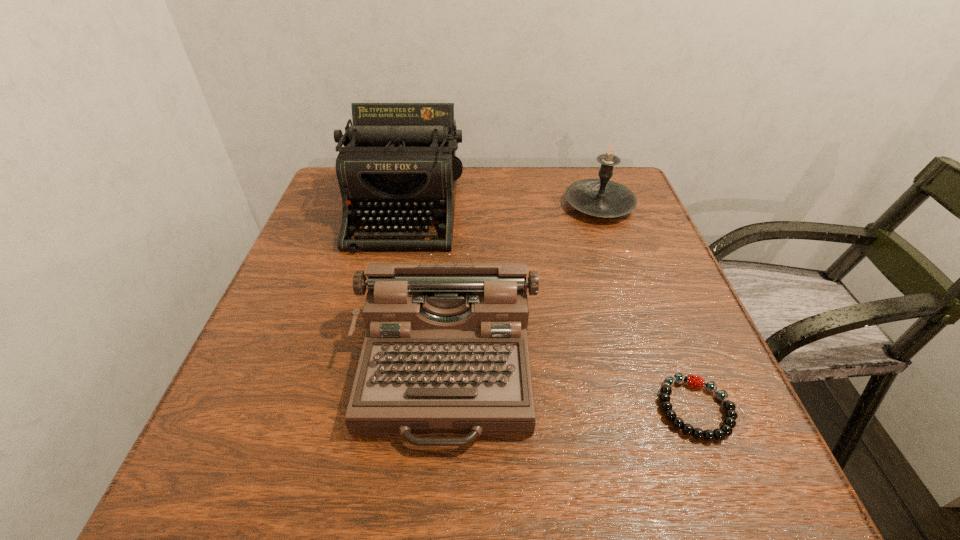
I want to click on object present at the near edge, so click(446, 352).

The height and width of the screenshot is (540, 960). Find the location of `object that is at the left edge`. object that is at the left edge is located at coordinates (398, 163).

The width and height of the screenshot is (960, 540). Identify the location of candle that is at the right edge. (601, 197).

Image resolution: width=960 pixels, height=540 pixels. What are the coordinates of `bracelet present at the right edge` in the screenshot? It's located at (726, 429).

Find the location of a particular element. The image size is (960, 540). object present at the far left corner is located at coordinates (398, 163).

This screenshot has height=540, width=960. Find the location of `object located at the far right corner`. object located at the far right corner is located at coordinates (601, 197).

Find the location of a particular element. vacant space at the far edge of the desktop is located at coordinates (557, 192).

You are a GUI agent. You are given a task and a screenshot of the screen. Output one action in this format:
    pyautogui.click(x=<x>, y=<y>)
    Task: Click on the free space at the left edge
    This screenshot has width=960, height=540.
    Given the screenshot: What is the action you would take?
    pyautogui.click(x=268, y=312)

What are the coordinates of `vacant space at the right edge of the desktop` in the screenshot? It's located at (643, 327).

This screenshot has width=960, height=540. What are the coordinates of `free space between the shortest object and the farther typewriter` in the screenshot? It's located at (550, 309).